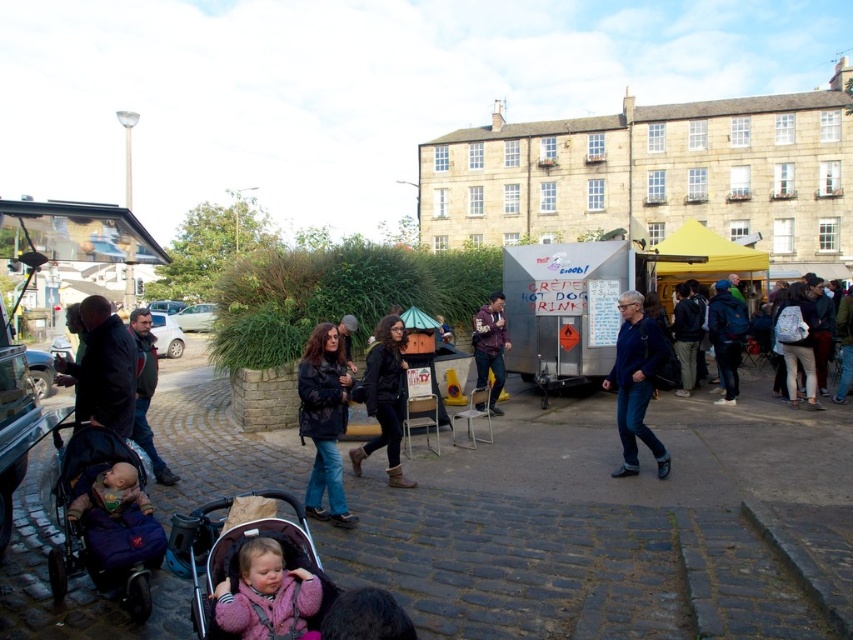
Can you confirm if matte pink stroller at lower left is taller than blue denim jeans at center?

No.

Does matte pink stroller at lower left have a greater width compared to blue denim jeans at center?

Yes.

This screenshot has width=853, height=640. What are the coordinates of `matte pink stroller at lower left` in the screenshot? It's located at (238, 552).

Find the location of `matte pink stroller at lower left`. matte pink stroller at lower left is located at coordinates (238, 552).

Is point (604, 353) closer to viewer compared to point (486, 332)?

Yes.

Measure the distance between point (541, 392) and camera.

A distance of 49.88 meters exists between point (541, 392) and camera.

Identify the location of silver metallic food truck at center. The image size is (853, 640). (569, 307).

Find the location of a particular element. pink fleece jacket at lower center is located at coordinates (x=265, y=595).

Between point (215, 588) and point (376, 445), which one is positioned behind?

The point (376, 445) is behind.

Does point (238, 596) lie in front of point (399, 413)?

Yes, it is.

I want to click on pink fleece jacket at lower center, so click(x=265, y=595).